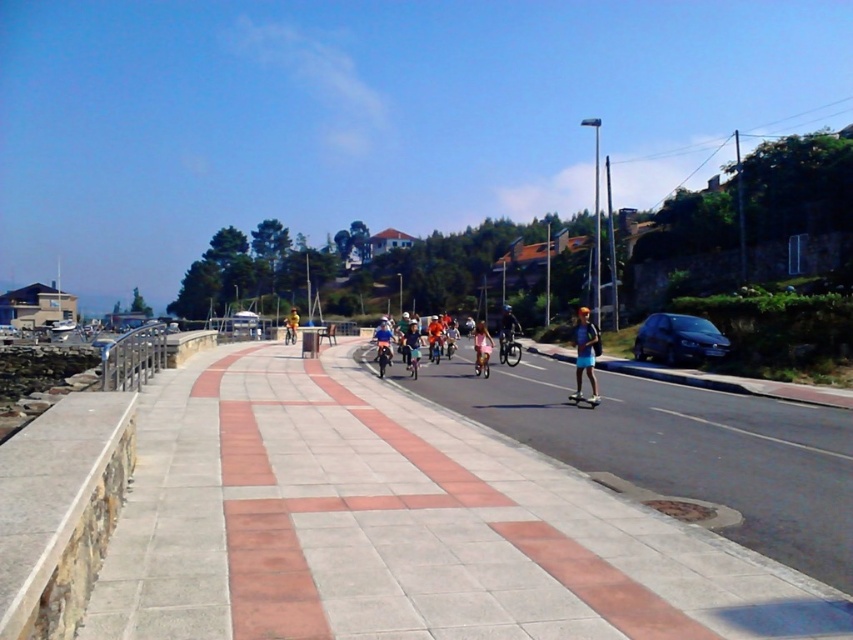
Question: Is brick paved sidewalk at center to the right of yellow fabric cyclist at center from the viewer's perspective?

Choices:
 (A) yes
 (B) no

Answer: (A)

Question: Which object is the closest to the dark blue metallic car at right?

Choices:
 (A) yellow fabric cyclist at center
 (B) matte pink shorts at center
 (C) brick paved sidewalk at center
 (D) light blue shorts at center

Answer: (D)

Question: Observing the image, what is the correct spatial positioning of dark blue metallic car at right in reference to yellow fabric cyclist at center?

Choices:
 (A) right
 (B) left

Answer: (A)

Question: Does dark blue metallic car at right appear on the right side of light blue shorts at center?

Choices:
 (A) yes
 (B) no

Answer: (A)

Question: Which point appears closest to the camera in this image?

Choices:
 (A) (577, 381)
 (B) (294, 339)

Answer: (A)

Question: Among these points, which one is nearest to the camera?

Choices:
 (A) (410, 321)
 (B) (482, 337)
 (C) (286, 339)
 (D) (578, 353)

Answer: (D)